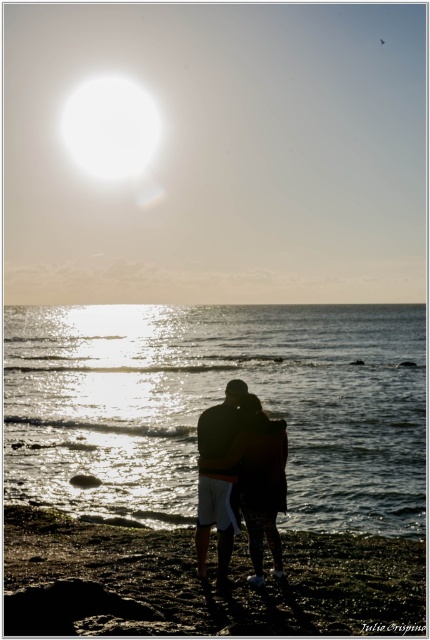
Is glistening water at center to the right of smooth sand at lower center from the viewer's perspective?

No, glistening water at center is not to the right of smooth sand at lower center.

Measure the distance between point (186, 362) and camera.

They are 67.64 meters apart.

Is point (95, 340) closer to viewer compared to point (168, 554)?

No, (95, 340) is behind (168, 554).

Locate an element on the screen. glistening water at center is located at coordinates (215, 403).

How much distance is there between smooth sand at lower center and silhouette fabric couple at center?

smooth sand at lower center and silhouette fabric couple at center are 14.18 feet apart from each other.

Between point (42, 534) and point (279, 460), which one is positioned in front?

Point (279, 460) is in front.

Find the location of a particular element. smooth sand at lower center is located at coordinates (199, 582).

Based on the photo, is glistening water at center below silhouette fabric couple at center?

Actually, glistening water at center is above silhouette fabric couple at center.

Can you confirm if glistening water at center is positioned above silhouette fabric couple at center?

Correct, glistening water at center is located above silhouette fabric couple at center.

Which is in front, point (224, 352) or point (258, 547)?

Point (258, 547)

The height and width of the screenshot is (640, 430). What are the coordinates of `glistening water at center` in the screenshot? It's located at click(x=215, y=403).